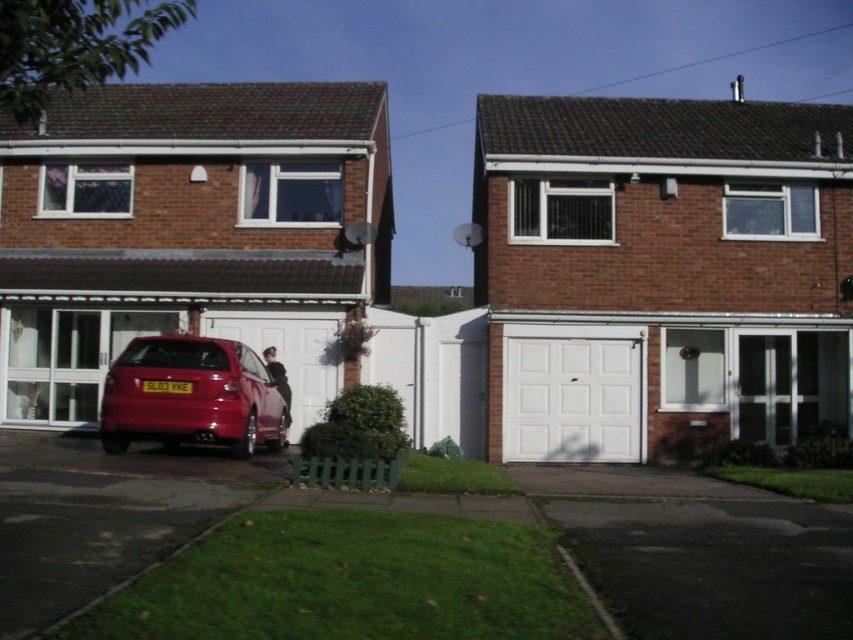
You are a delivery person trying to park a van that is 2 meters wide. You see the white matte garage door at center and the glossy red car at lower left. Can you park your van between them without overlapping?

The white matte garage door at center has a larger size compared to the glossy red car at lower left. Since the van is 2 meters wide, you need to check the distance between them. However, the description only mentions their sizes, not the distance between them. Therefore, it is unclear if there is enough space to park the van between them without overlapping.

You are a delivery person trying to park your van next to the glossy red car at lower left and the white matte garage door at center. Can you park your van between them if your van is 2 meters wide?

The white matte garage door at center is taller than the glossy red car at lower left, but the question is about width. Since the objects description does not provide information about the distance or width between them, we cannot determine if the van can fit. More information is needed.